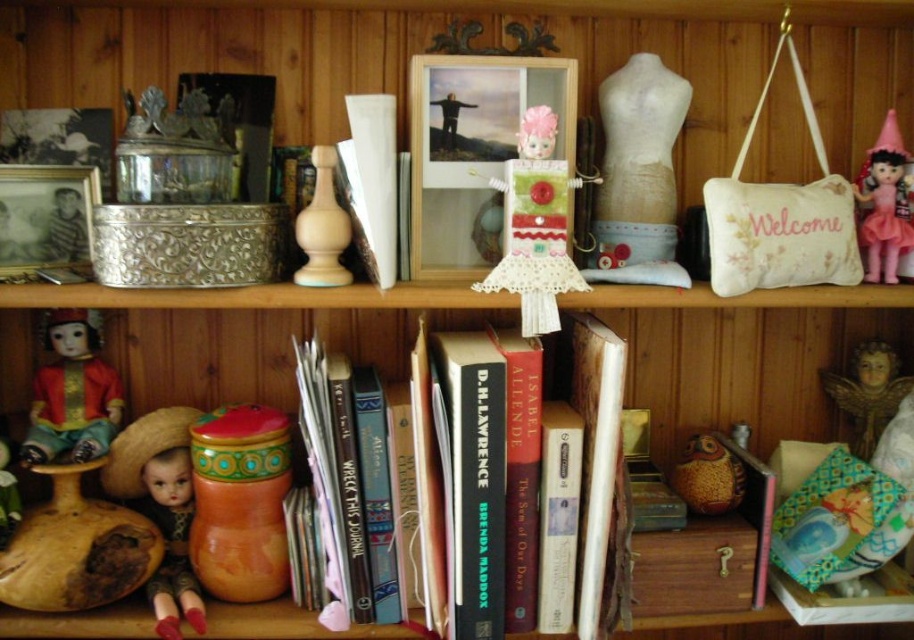
Question: Considering the relative positions of hardcover book at center and orange painted wood jar at lower left in the image provided, where is hardcover book at center located with respect to orange painted wood jar at lower left?

Choices:
 (A) left
 (B) right

Answer: (B)

Question: Which object is the farthest from the matte green fabric doll at center?

Choices:
 (A) matte porcelain doll at lower left
 (B) matte red doll at lower left

Answer: (B)

Question: Among these objects, which one is nearest to the camera?

Choices:
 (A) matte red doll at lower left
 (B) matte brown owl at lower right
 (C) pink fabric doll at upper right

Answer: (A)

Question: Among these objects, which one is nearest to the camera?

Choices:
 (A) pink fabric doll at upper right
 (B) hardcover books at center
 (C) matte green fabric doll at center
 (D) matte brown owl at lower right

Answer: (B)

Question: Can you confirm if hardcover books at center is positioned to the left of white paper book at center?

Choices:
 (A) no
 (B) yes

Answer: (A)

Question: Is hardcover book at center further to camera compared to matte red doll at lower left?

Choices:
 (A) yes
 (B) no

Answer: (B)